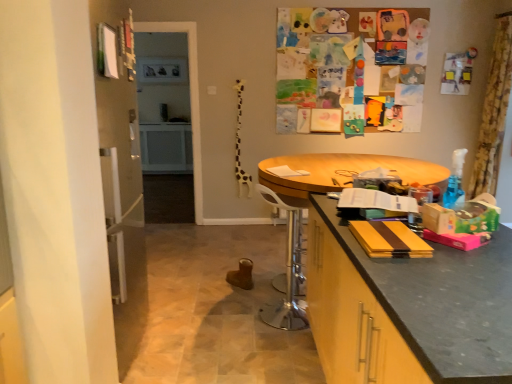
Find the location of a particular element. free space to the left of white plastic swivel chair at center is located at coordinates (232, 315).